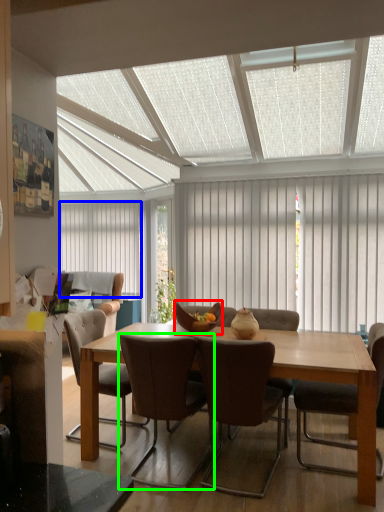
Question: Which is nearer to the bowl (highlighted by a red box)? curtain (highlighted by a blue box) or chair (highlighted by a green box).

Choices:
 (A) curtain
 (B) chair

Answer: (B)